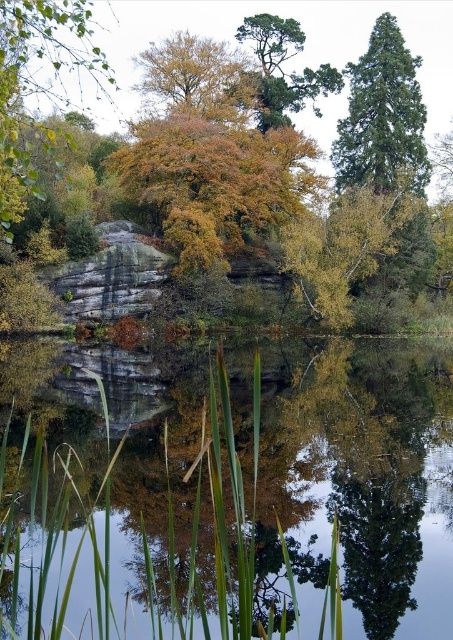
Consider the image. You are planning to install a small garden bench between the green textured tree at upper right and the green textured pine tree at upper center. The bench requires a minimum of 6 meters of space between the two trees to be placed comfortably. Can you place the bench there?

The green textured tree at upper right and green textured pine tree at upper center are 7.07 meters apart, which is more than the required 6 meters. Therefore, the bench can be placed comfortably between them.

You are an artist trying to paint the scene. You want to place the transparent glass water at center to the right of the golden yellow leaves at upper center. Does the current arrangement match your intention?

Yes, the transparent glass water at center is already positioned on the right side of the golden yellow leaves at upper center, which matches your desired arrangement.